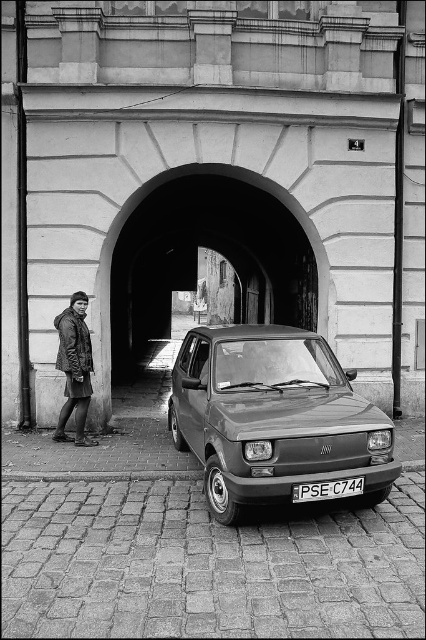
Question: Which object appears closest to the camera in this image?

Choices:
 (A) smooth stone archway at center
 (B) dark gray jacket at left
 (C) white plastic license plate at center
 (D) matte gray hatchback at center

Answer: (D)

Question: Can you confirm if smooth stone archway at center is smaller than dark gray jacket at left?

Choices:
 (A) no
 (B) yes

Answer: (A)

Question: Can you confirm if smooth stone archway at center is bigger than dark gray jacket at left?

Choices:
 (A) no
 (B) yes

Answer: (B)

Question: Which object is positioned farthest from the matte gray hatchback at center?

Choices:
 (A) dark gray jacket at left
 (B) white plastic license plate at center
 (C) smooth stone archway at center

Answer: (C)

Question: Which point is farther to the camera?

Choices:
 (A) (204, 413)
 (B) (63, 404)
 (C) (229, 168)

Answer: (C)

Question: Does dark gray jacket at left have a smaller size compared to white plastic license plate at center?

Choices:
 (A) yes
 (B) no

Answer: (B)